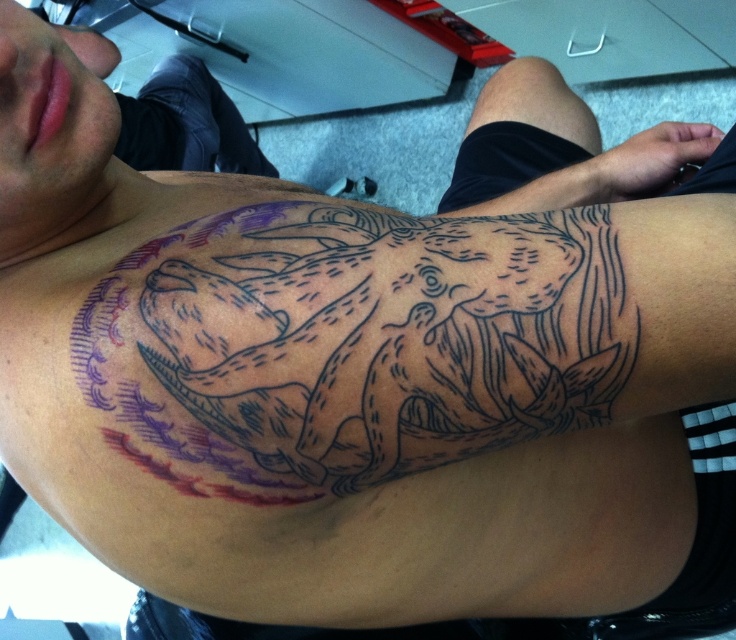
You are a tattoo artist reviewing a client arm. You see the black ink tattoo at upper center and the black ink tattoo at upper right. Which one is closer to the shoulder?

The black ink tattoo at upper right is closer to the shoulder because the black ink tattoo at upper center is positioned under it.

You are a tattoo artist who needs to place a new tattoo on the arm. The client wants to know if there is enough space between the existing black ink tattoo at upper center and the black ink tattoo at upper right to fit a new 10 inch wide tattoo. Can you confirm?

The existing black ink tattoo at upper center and black ink tattoo at upper right are 15.20 inches apart. Since the new tattoo is 10 inches wide, there is sufficient space between them to accommodate it without overlapping.

You are a tattoo artist reviewing a client who has two tattoos on their arm. The client wants to know which tattoo is larger. You see the black ink tattoo at upper center and the black ink tattoo at upper right. Which one is bigger?

The black ink tattoo at upper right is larger than the black ink tattoo at upper center.